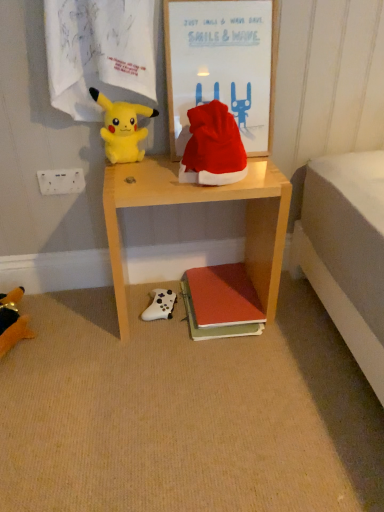
Where is `free space to the left of matte orange book at lower center`? This screenshot has height=512, width=384. free space to the left of matte orange book at lower center is located at coordinates (142, 317).